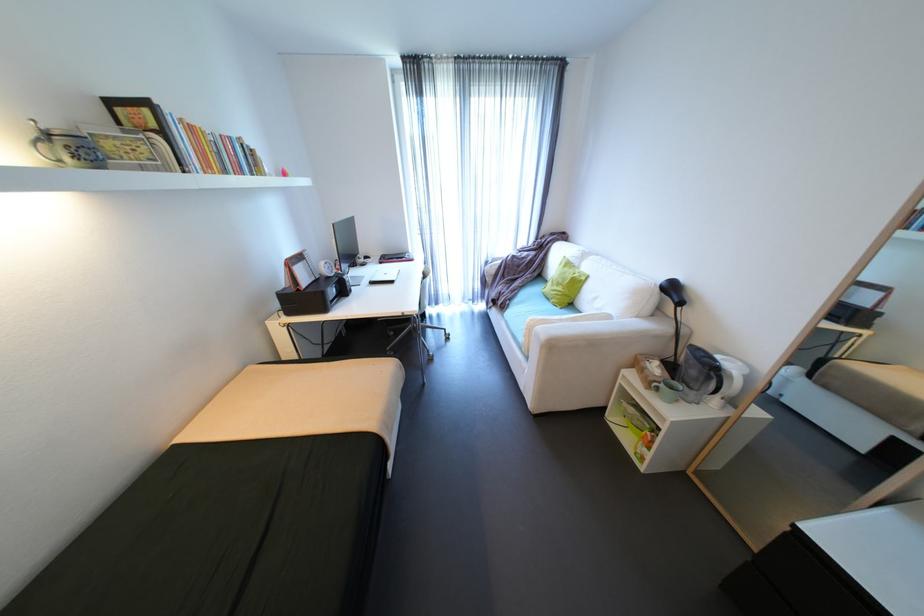
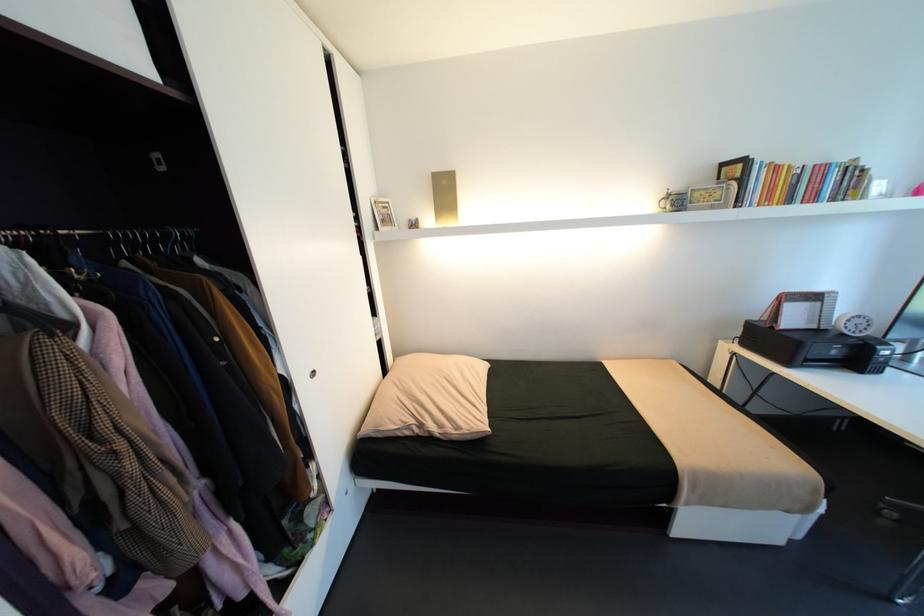
Locate, in the second image, the point that corresponds to (227,136) in the first image.

(821, 166)